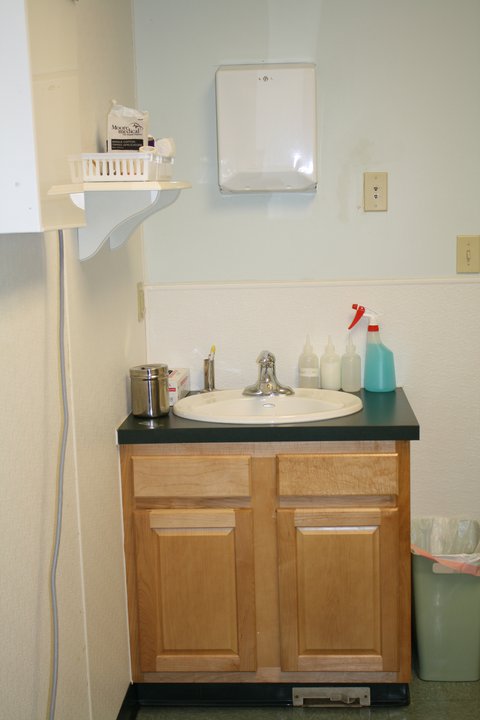
Identify the location of trash bag. This screenshot has width=480, height=720. (469, 562).